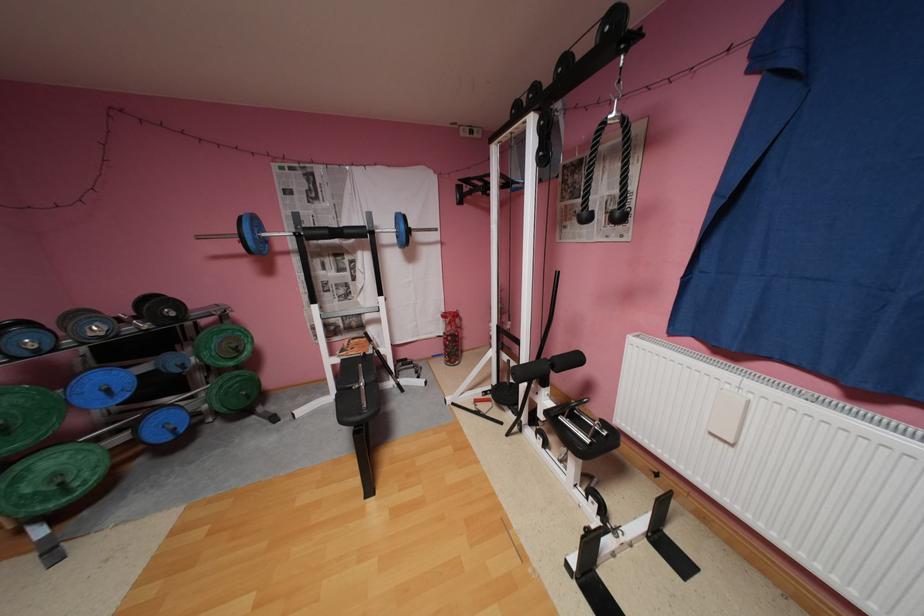
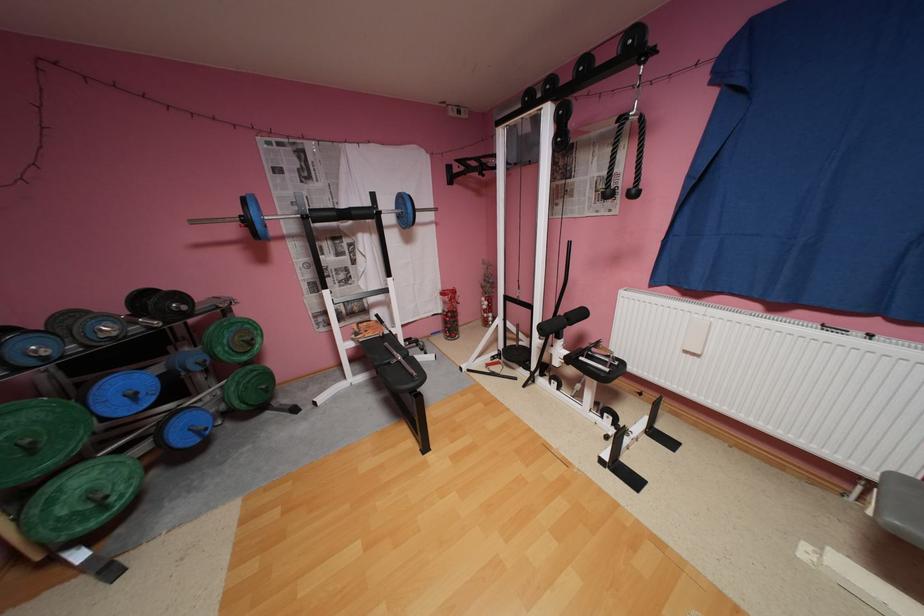
In the second image, find the point that corresponds to point 116,391 in the first image.

(142, 395)